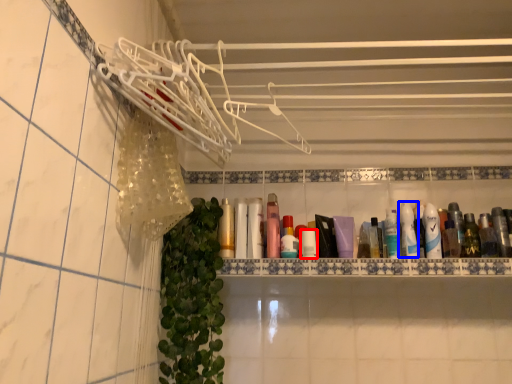
Question: Which object appears farthest to the camera in this image, toiletry (highlighted by a red box) or toiletry (highlighted by a blue box)?

Choices:
 (A) toiletry
 (B) toiletry

Answer: (B)